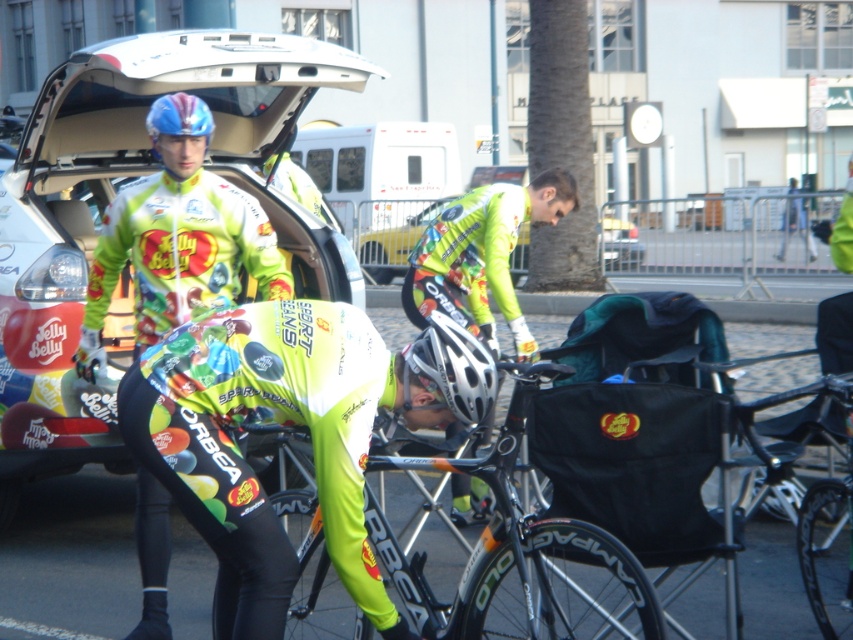
Question: Considering the real-world distances, which object is farthest from the shiny metallic bicycle at center?

Choices:
 (A) matte white car at center
 (B) silver metallic helmet at center
 (C) shiny blue helmet at upper left

Answer: (A)

Question: Is shiny metallic bicycle at center positioned behind matte jersey at center?

Choices:
 (A) no
 (B) yes

Answer: (A)

Question: Can you confirm if matte jersey at center is bigger than silver metallic helmet at center?

Choices:
 (A) yes
 (B) no

Answer: (A)

Question: Which object is the closest to the silver metallic helmet at center?

Choices:
 (A) shiny metallic bicycle at center
 (B) matte jersey at center

Answer: (A)

Question: Does neon green jersey at center appear on the left side of matte jersey at center?

Choices:
 (A) yes
 (B) no

Answer: (B)

Question: Which of the following is the farthest from the observer?

Choices:
 (A) neon green jersey at center
 (B) matte white car at center

Answer: (B)